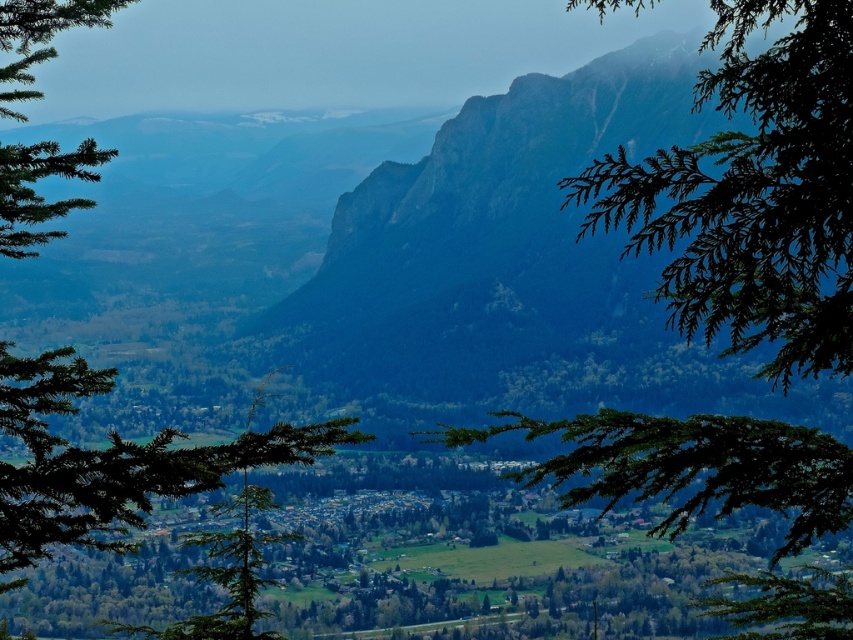
Does green leafy branch at upper right appear on the right side of green matte tree at center?

Correct, you'll find green leafy branch at upper right to the right of green matte tree at center.

Is green leafy branch at upper right wider than green matte tree at center?

No.

Where is `green leafy branch at upper right`? Image resolution: width=853 pixels, height=640 pixels. green leafy branch at upper right is located at coordinates (753, 193).

Who is shorter, green leafy branch at center or green matte tree at center?

green matte tree at center is shorter.

Which of these two, green leafy branch at center or green matte tree at center, stands taller?

green leafy branch at center

Who is more forward, [820,266] or [9,157]?

Point [820,266] is in front.

Image resolution: width=853 pixels, height=640 pixels. I want to click on green leafy branch at center, so click(x=752, y=195).

Can you confirm if green leafy branch at center is wider than green leafy branch at upper right?

Yes.

Identify the location of green leafy branch at center. (752, 195).